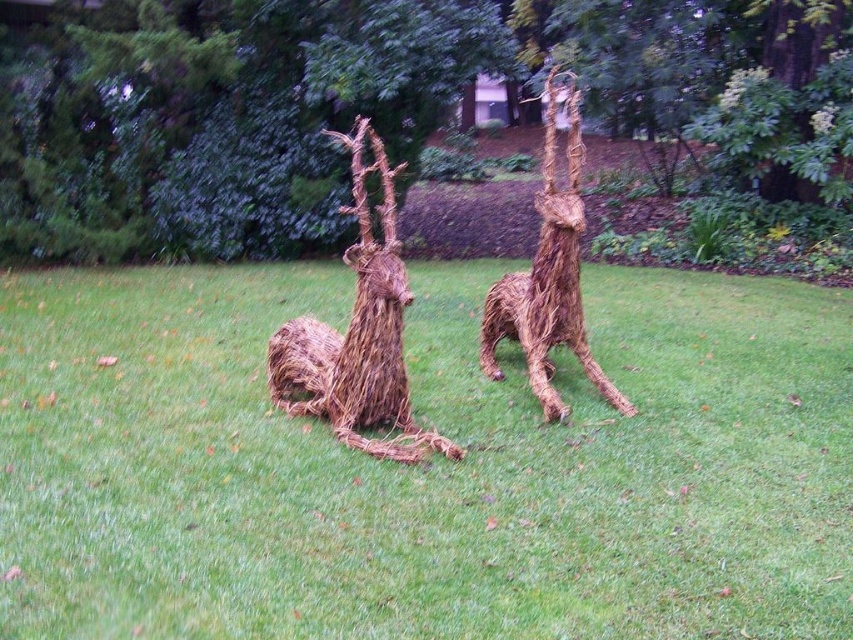
Does point (190, 525) lie behind point (548, 104)?

No, (190, 525) is closer to viewer.

Can you confirm if green grass at center is wider than braided straw giraffe at center?

Correct, the width of green grass at center exceeds that of braided straw giraffe at center.

Identify the location of green grass at center. (422, 465).